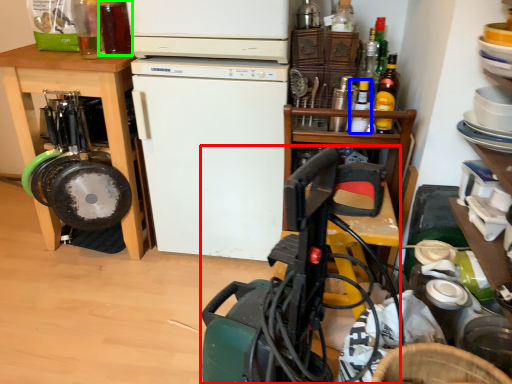
Question: Based on their relative distances, which object is farther from appliance (highlighted by a red box)? Choose from bottle (highlighted by a blue box) and bottle (highlighted by a green box).

Choices:
 (A) bottle
 (B) bottle

Answer: (B)